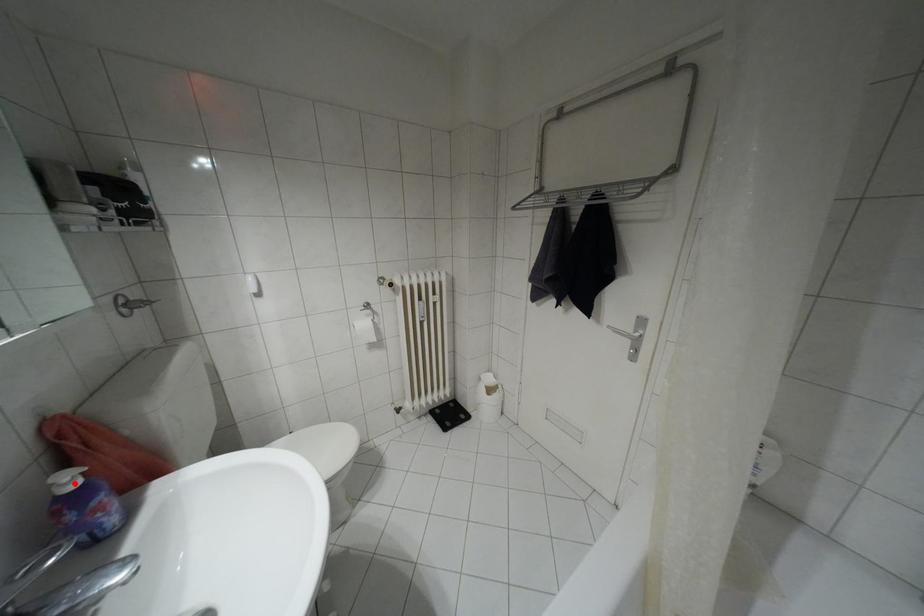
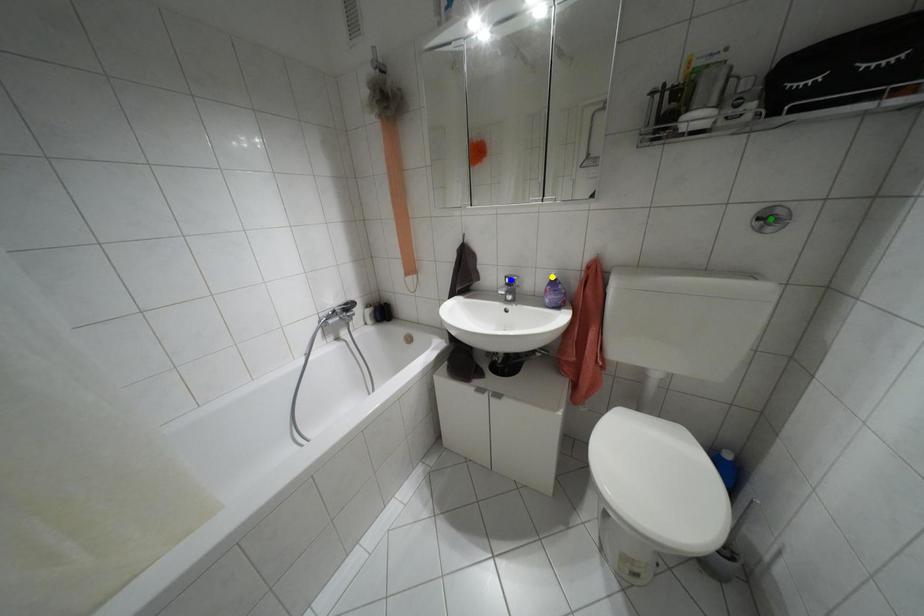
Question: I am providing you with two images of the same scene from different viewpoints. A red point is marked on the first image. You are given multiple points on the second image. Which point in image 2 is actually the same real-world point as the red point in image 1?

Choices:
 (A) blue point
 (B) green point
 (C) yellow point

Answer: (C)